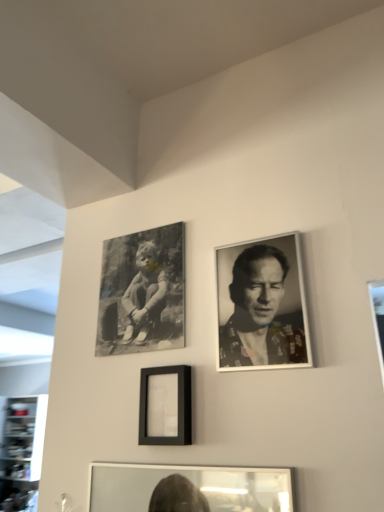
Question: Is black and white portrait at upper right wider or thinner than matte black frame at center, arranged as the second picture frame when viewed from the back?

Choices:
 (A) thin
 (B) wide

Answer: (A)

Question: From a real-world perspective, is black and white portrait at upper right above or below matte black frame at center, the first picture frame positioned from the bottom?

Choices:
 (A) below
 (B) above

Answer: (B)

Question: Which of these objects is positioned closest to the black and white portrait at upper right?

Choices:
 (A) black matte canvas at upper left, the 2th picture frame in the bottom-to-top sequence
 (B) matte black frame at center, placed as the 2th picture frame when sorted from top to bottom

Answer: (B)

Question: Which object is positioned closest to the black matte canvas at upper left, the 2th picture frame in the bottom-to-top sequence?

Choices:
 (A) matte black frame at center, the first picture frame positioned from the bottom
 (B) black and white portrait at upper right

Answer: (A)